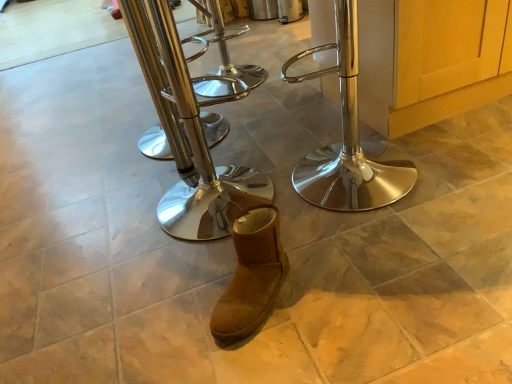
Where is `free space between polished metal bar stool at center, the third step stool viewed from the right, and polished chrome stool at center, which appears as the 1th step stool when viewed from the right`? free space between polished metal bar stool at center, the third step stool viewed from the right, and polished chrome stool at center, which appears as the 1th step stool when viewed from the right is located at coordinates (253, 150).